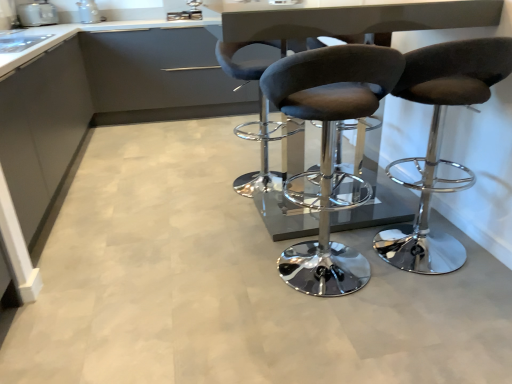
You are a GUI agent. You are given a task and a screenshot of the screen. Output one action in this format:
    pyautogui.click(x=<x>, y=<y>)
    Task: Click on the dark gray fabric stool at center, the first chair in the left-to-right sequence
    The image size is (512, 384).
    Given the screenshot: What is the action you would take?
    pyautogui.click(x=262, y=154)

How much space does velvet-like dark gray stool at center, the second chair when ordered from left to right, occupy horizontally?

It is 19.86 inches.

This screenshot has width=512, height=384. What do you see at coordinates (37, 14) in the screenshot?
I see `metallic silver toaster at upper left, marked as the second appliance in a right-to-left arrangement` at bounding box center [37, 14].

At what (x,y) coordinates should I click in order to perform the action: click on matte gray cabinet at left. Please return your answer as a coordinate pair (x, y). The width and height of the screenshot is (512, 384). Looking at the image, I should click on pyautogui.click(x=42, y=129).

I want to click on dark gray fabric stool at center, which is the 3th chair from right to left, so click(262, 154).

Is dark gray fabric stool at center, the first chair in the left-to-right sequence, inside the boundaries of metallic gray table at center, or outside?

dark gray fabric stool at center, the first chair in the left-to-right sequence, is not enclosed by metallic gray table at center.

Considering the points (247, 194) and (234, 43), which point is in front, point (247, 194) or point (234, 43)?

The point (234, 43) is in front.

Is dark gray fabric stool at center, which is the 3th chair from right to left, looking in the opposite direction of metallic gray table at center?

No, dark gray fabric stool at center, which is the 3th chair from right to left,'s orientation is not away from metallic gray table at center.

Is white glossy toaster at upper left, the second appliance in the left-to-right sequence, looking in the opposite direction of velvet-like dark gray stool at center, the second chair when ordered from left to right?

That's not correct — white glossy toaster at upper left, the second appliance in the left-to-right sequence, is not looking away from velvet-like dark gray stool at center, the second chair when ordered from left to right.

Between white glossy toaster at upper left, the second appliance in the left-to-right sequence, and velvet-like dark gray stool at center, the 2th chair positioned from the right, which one is positioned in front?

velvet-like dark gray stool at center, the 2th chair positioned from the right, is closer to the camera.

Is white glossy toaster at upper left, which is the first appliance from right to left, touching velvet-like dark gray stool at center, the second chair when ordered from left to right?

No, white glossy toaster at upper left, which is the first appliance from right to left, is not making contact with velvet-like dark gray stool at center, the second chair when ordered from left to right.

From the picture: Measure the distance from white glossy toaster at upper left, which is the first appliance from right to left, to velvet-like dark gray stool at center, the second chair when ordered from left to right.

white glossy toaster at upper left, which is the first appliance from right to left, is 3.24 meters from velvet-like dark gray stool at center, the second chair when ordered from left to right.

Considering the sizes of objects metallic silver toaster at upper left, marked as the second appliance in a right-to-left arrangement, and metallic gray table at center in the image provided, who is smaller, metallic silver toaster at upper left, marked as the second appliance in a right-to-left arrangement, or metallic gray table at center?

metallic silver toaster at upper left, marked as the second appliance in a right-to-left arrangement, is smaller.

Does metallic silver toaster at upper left, the first appliance positioned from the left, have a lesser height compared to metallic gray table at center?

Correct, metallic silver toaster at upper left, the first appliance positioned from the left, is not as tall as metallic gray table at center.

Which object is positioned more to the right, metallic silver toaster at upper left, the first appliance positioned from the left, or metallic gray table at center?

metallic gray table at center.

Is metallic silver toaster at upper left, the first appliance positioned from the left, wider or thinner than metallic gray table at center?

metallic silver toaster at upper left, the first appliance positioned from the left, is thinner than metallic gray table at center.

Are white glossy toaster at upper left, which is the first appliance from right to left, and suede-like brown stool at center, the third chair from the left, making contact?

No, white glossy toaster at upper left, which is the first appliance from right to left, is not touching suede-like brown stool at center, the third chair from the left.

Considering their positions, is white glossy toaster at upper left, which is the first appliance from right to left, located in front of or behind suede-like brown stool at center, the third chair from the left?

Clearly, white glossy toaster at upper left, which is the first appliance from right to left, is behind suede-like brown stool at center, the third chair from the left.

In terms of size, does white glossy toaster at upper left, the second appliance in the left-to-right sequence, appear bigger or smaller than suede-like brown stool at center, the third chair from the left?

white glossy toaster at upper left, the second appliance in the left-to-right sequence, is smaller than suede-like brown stool at center, the third chair from the left.

How far apart are white glossy toaster at upper left, the second appliance in the left-to-right sequence, and suede-like brown stool at center, the third chair from the left?

white glossy toaster at upper left, the second appliance in the left-to-right sequence, is 3.40 meters from suede-like brown stool at center, the third chair from the left.

Is velvet-like dark gray stool at center, the 2th chair positioned from the right, far from suede-like brown stool at center, arranged as the first chair when viewed from the right?

They are positioned close to each other.

Which of these two, velvet-like dark gray stool at center, the second chair when ordered from left to right, or suede-like brown stool at center, the third chair from the left, is wider?

With larger width is suede-like brown stool at center, the third chair from the left.

How much distance is there between velvet-like dark gray stool at center, the 2th chair positioned from the right, and suede-like brown stool at center, the third chair from the left?

A distance of 51.21 centimeters exists between velvet-like dark gray stool at center, the 2th chair positioned from the right, and suede-like brown stool at center, the third chair from the left.

From a real-world perspective, is velvet-like dark gray stool at center, the 2th chair positioned from the right, on top of suede-like brown stool at center, the third chair from the left?

Yes, from a real-world perspective, velvet-like dark gray stool at center, the 2th chair positioned from the right, is over suede-like brown stool at center, the third chair from the left

Who is taller, metallic silver toaster at upper left, the first appliance positioned from the left, or suede-like brown stool at center, the third chair from the left?

With more height is suede-like brown stool at center, the third chair from the left.

Does point (49, 3) come behind point (451, 96)?

Yes.

Is metallic silver toaster at upper left, marked as the second appliance in a right-to-left arrangement, turned away from suede-like brown stool at center, arranged as the first chair when viewed from the right?

No, metallic silver toaster at upper left, marked as the second appliance in a right-to-left arrangement, is not facing away from suede-like brown stool at center, arranged as the first chair when viewed from the right.

Does suede-like brown stool at center, arranged as the first chair when viewed from the right, come in front of matte gray cabinet at left?

Yes, it is in front of matte gray cabinet at left.

From a real-world perspective, relative to matte gray cabinet at left, is suede-like brown stool at center, the third chair from the left, vertically above or below?

suede-like brown stool at center, the third chair from the left, is situated higher than matte gray cabinet at left in the real world.

Image resolution: width=512 pixels, height=384 pixels. Identify the location of table that appears below the dark gray fabric stool at center, which is the 3th chair from right to left (from the image's perspective). (348, 18).

From a real-world perspective, starting from the velvet-like dark gray stool at center, the 2th chair positioned from the right, which appliance is the 1st one vertically above it? Please provide its 2D coordinates.

[(88, 12)]

Considering their positions, is velvet-like dark gray stool at center, the second chair when ordered from left to right, positioned further to white glossy toaster at upper left, which is the first appliance from right to left, than dark gray fabric stool at center, the first chair in the left-to-right sequence?

Among the two, velvet-like dark gray stool at center, the second chair when ordered from left to right, is located further to white glossy toaster at upper left, which is the first appliance from right to left.

When comparing their distances from suede-like brown stool at center, arranged as the first chair when viewed from the right, does metallic gray table at center or matte gray cabinet at left seem further?

Among the two, matte gray cabinet at left is located further to suede-like brown stool at center, arranged as the first chair when viewed from the right.

Which object lies nearer to the anchor point velvet-like dark gray stool at center, the second chair when ordered from left to right, dark gray fabric stool at center, which is the 3th chair from right to left, or metallic silver toaster at upper left, marked as the second appliance in a right-to-left arrangement?

dark gray fabric stool at center, which is the 3th chair from right to left, is closer to velvet-like dark gray stool at center, the second chair when ordered from left to right.

Estimate the real-world distances between objects in this image. Which object is closer to metallic silver toaster at upper left, the first appliance positioned from the left, velvet-like dark gray stool at center, the 2th chair positioned from the right, or dark gray fabric stool at center, which is the 3th chair from right to left?

dark gray fabric stool at center, which is the 3th chair from right to left.

Looking at the image, which one is located further to metallic gray table at center, velvet-like dark gray stool at center, the second chair when ordered from left to right, or metallic silver toaster at upper left, marked as the second appliance in a right-to-left arrangement?

metallic silver toaster at upper left, marked as the second appliance in a right-to-left arrangement.

Looking at the image, which one is located closer to velvet-like dark gray stool at center, the second chair when ordered from left to right, suede-like brown stool at center, arranged as the first chair when viewed from the right, or dark gray fabric stool at center, the first chair in the left-to-right sequence?

The object closer to velvet-like dark gray stool at center, the second chair when ordered from left to right, is suede-like brown stool at center, arranged as the first chair when viewed from the right.

Which object lies further to the anchor point metallic gray table at center, dark gray fabric stool at center, which is the 3th chair from right to left, or matte gray cabinet at left?

matte gray cabinet at left is further to metallic gray table at center.

Based on their spatial positions, is matte gray cabinet at left or metallic gray table at center closer to dark gray fabric stool at center, which is the 3th chair from right to left?

Among the two, metallic gray table at center is located nearer to dark gray fabric stool at center, which is the 3th chair from right to left.

Find the location of a particular element. The height and width of the screenshot is (384, 512). table located between metallic silver toaster at upper left, marked as the second appliance in a right-to-left arrangement, and suede-like brown stool at center, the third chair from the left, in the left-right direction is located at coordinates (348, 18).

At what (x,y) coordinates should I click in order to perform the action: click on chair between matte gray cabinet at left and metallic silver toaster at upper left, marked as the second appliance in a right-to-left arrangement, along the z-axis. Please return your answer as a coordinate pair (x, y). The image size is (512, 384). Looking at the image, I should click on (262, 154).

Locate an element on the screen. table between suede-like brown stool at center, arranged as the first chair when viewed from the right, and white glossy toaster at upper left, which is the first appliance from right to left, from front to back is located at coordinates (348, 18).

You are a GUI agent. You are given a task and a screenshot of the screen. Output one action in this format:
    pyautogui.click(x=<x>, y=<y>)
    Task: Click on the table between velvet-like dark gray stool at center, the second chair when ordered from left to right, and suede-like brown stool at center, the third chair from the left, from left to right
    This screenshot has width=512, height=384.
    Given the screenshot: What is the action you would take?
    [348, 18]